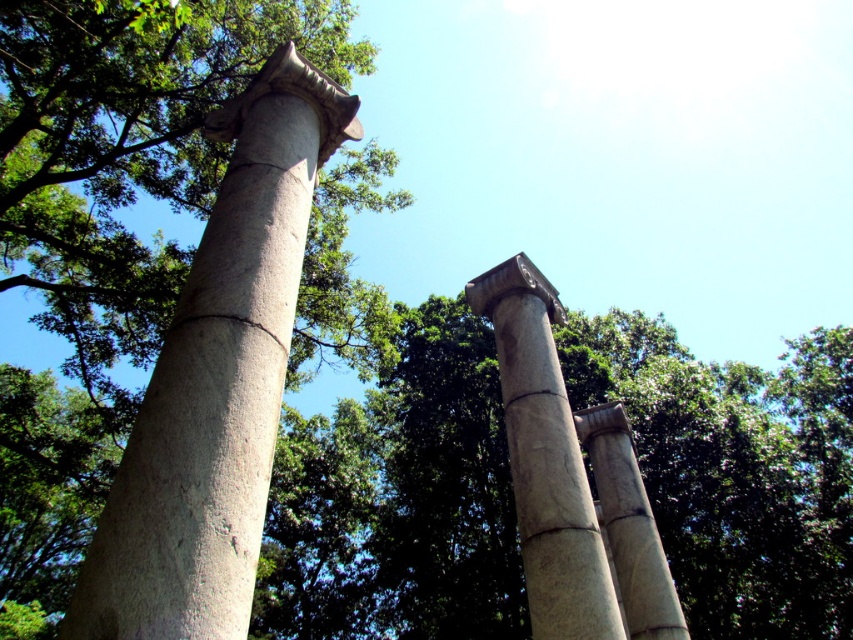
Question: Observing the image, what is the correct spatial positioning of smooth gray column at left in reference to gray stone column at center?

Choices:
 (A) above
 (B) below

Answer: (A)

Question: Which object is farther from the camera taking this photo?

Choices:
 (A) smooth gray column at left
 (B) gray stone column at center
 (C) white stone column at center

Answer: (B)

Question: Is smooth gray column at left above gray stone column at center?

Choices:
 (A) no
 (B) yes

Answer: (B)

Question: Is white stone column at center wider than gray stone column at center?

Choices:
 (A) yes
 (B) no

Answer: (B)

Question: Which point is farther to the camera?

Choices:
 (A) white stone column at center
 (B) smooth gray column at left
 (C) gray stone column at center

Answer: (C)

Question: Which object is the farthest from the smooth gray column at left?

Choices:
 (A) gray stone column at center
 (B) white stone column at center

Answer: (A)